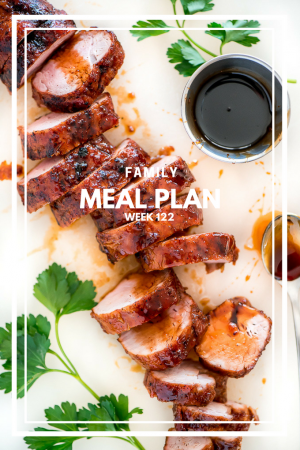
This screenshot has height=450, width=300. Find the location of `metal spoon`. metal spoon is located at coordinates (295, 290).